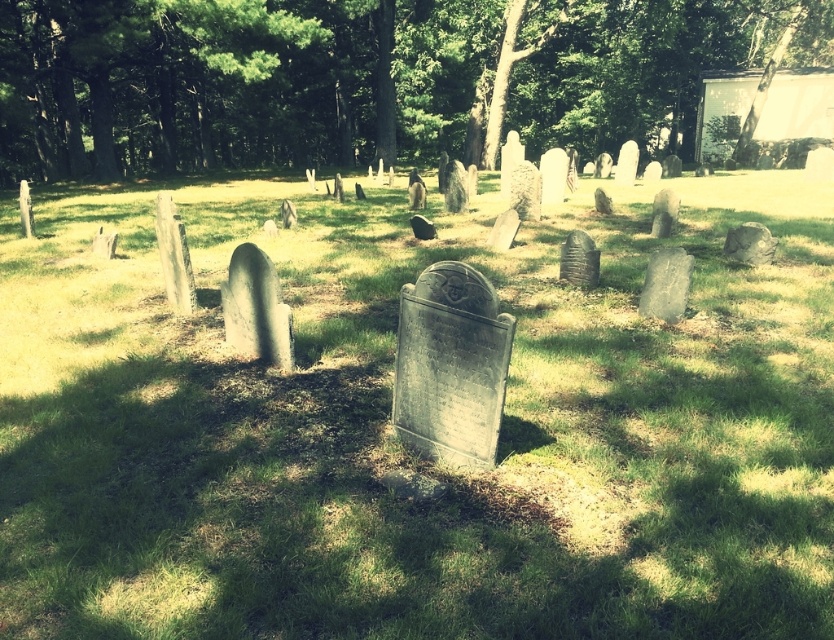
You are standing in the cemetery and want to walk from the point at coordinates (x=757, y=332) to the point at coordinates (x=671, y=148). Which direction should you face to move towards the second point?

Since point (x=757, y=332) is closer to the viewer than point (x=671, y=148), you should face away from the viewer to move towards the second point.

You are standing in the cemetery and want to place a small bouquet of flowers. You have two options for placement based on the scene. The first option is on the green grassy at center, and the second is under the green leafy tree at upper center. Which location has more space available for the bouquet?

The green grassy at center is smaller than the green leafy tree at upper center, so the green leafy tree at upper center has more space available for the bouquet.

You are standing in the cemetery and want to place a bouquet of flowers. You see the green grassy at center and the green leafy tree at upper center. Which location would be more sheltered from direct sunlight?

The green grassy at center is positioned under the green leafy tree at upper center, so placing the bouquet there would provide shelter from direct sunlight.